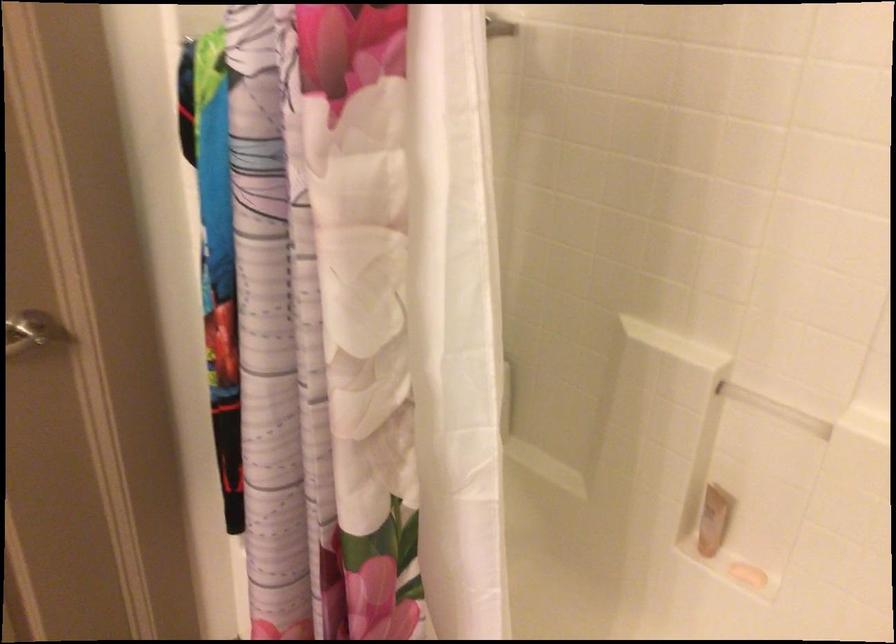
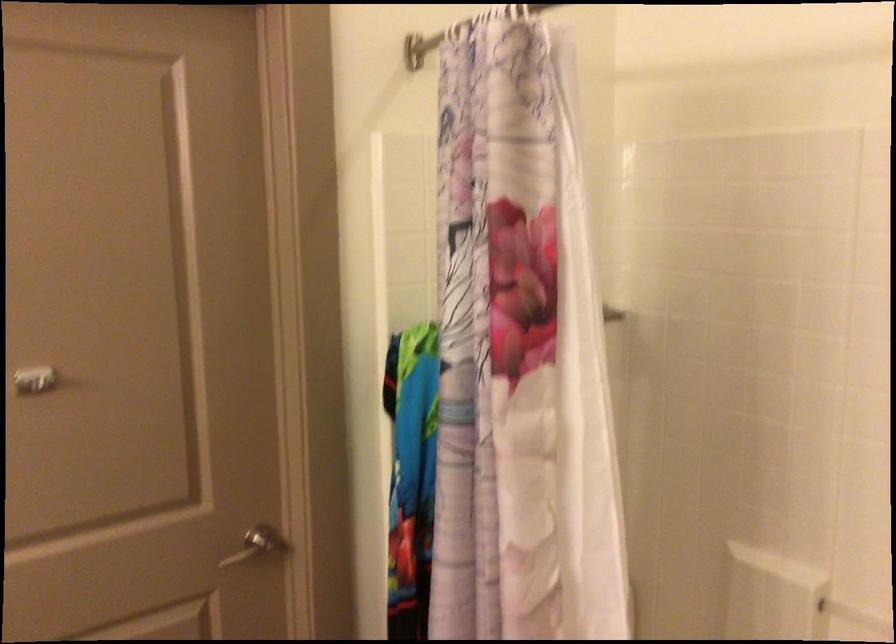
Question: In a continuous first-person perspective shot, in which direction is the camera moving?

Choices:
 (A) Left
 (B) Right
 (C) Forward
 (D) Backward

Answer: (D)